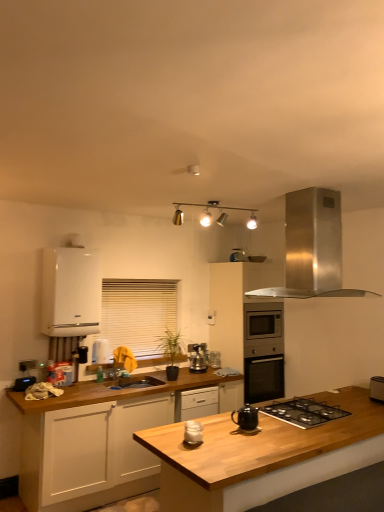
Question: Is wooden at center shorter than white blinds at center?

Choices:
 (A) yes
 (B) no

Answer: (B)

Question: Is wooden at center positioned in front of white blinds at center?

Choices:
 (A) no
 (B) yes

Answer: (B)

Question: From a real-world perspective, does wooden at center sit lower than white blinds at center?

Choices:
 (A) yes
 (B) no

Answer: (A)

Question: Is wooden at center positioned behind white blinds at center?

Choices:
 (A) yes
 (B) no

Answer: (B)

Question: Is wooden at center not within white blinds at center?

Choices:
 (A) yes
 (B) no

Answer: (A)

Question: Would you say wooden at center is to the left or to the right of metallic track lighting at upper center in the picture?

Choices:
 (A) right
 (B) left

Answer: (A)

Question: In terms of height, does wooden at center look taller or shorter compared to metallic track lighting at upper center?

Choices:
 (A) short
 (B) tall

Answer: (B)

Question: Is wooden at center wider or thinner than metallic track lighting at upper center?

Choices:
 (A) thin
 (B) wide

Answer: (B)

Question: From a real-world perspective, relative to metallic track lighting at upper center, is wooden at center vertically above or below?

Choices:
 (A) below
 (B) above

Answer: (A)

Question: Considering the positions of point (132, 296) and point (243, 413), is point (132, 296) closer or farther from the camera than point (243, 413)?

Choices:
 (A) closer
 (B) farther

Answer: (B)

Question: In the image, is white blinds at center on the left side or the right side of black matte teapot at center, the 2th kitchen appliance viewed from the front?

Choices:
 (A) right
 (B) left

Answer: (B)

Question: Considering the positions of white blinds at center and black matte teapot at center, the 2th kitchen appliance viewed from the front, in the image, is white blinds at center wider or thinner than black matte teapot at center, the 2th kitchen appliance viewed from the front,?

Choices:
 (A) wide
 (B) thin

Answer: (B)

Question: In terms of height, does white blinds at center look taller or shorter compared to black matte teapot at center, acting as the second kitchen appliance starting from the back?

Choices:
 (A) tall
 (B) short

Answer: (A)

Question: In terms of height, does stainless steel range hood at upper right look taller or shorter compared to white matte cabinet at lower left, positioned as the second cabinetry in right-to-left order?

Choices:
 (A) tall
 (B) short

Answer: (B)

Question: Looking at their shapes, would you say stainless steel range hood at upper right is wider or thinner than white matte cabinet at lower left, positioned as the second cabinetry in right-to-left order?

Choices:
 (A) thin
 (B) wide

Answer: (A)